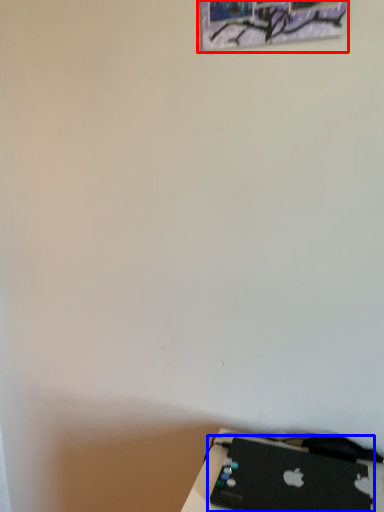
Question: Which point is further to the camera, picture frame (highlighted by a red box) or laptop (highlighted by a blue box)?

Choices:
 (A) picture frame
 (B) laptop

Answer: (A)